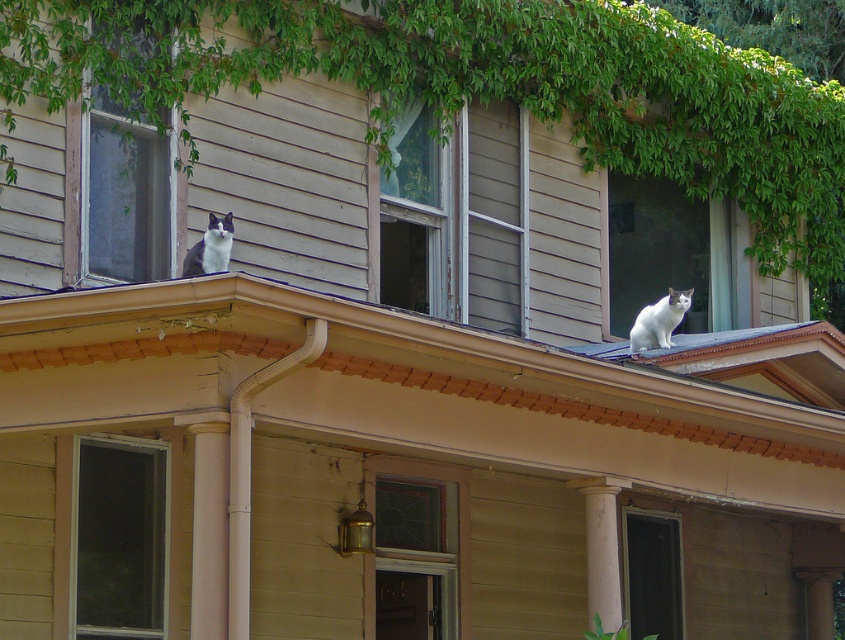
You are a contractor assessing the porch structure of the house. You see two columns supporting the porch roof. The columns are labeled as the white smooth column at center and the white marble column at center. According to building codes, the shorter column must be reinforced. Which column needs reinforcement?

The white marble column at center needs reinforcement because it is shorter than the white smooth column at center, as stated in the objects description.

You are standing in front of the two story house and want to locate two specific points marked on the roof. The first point is at coordinates point [508,182] and the second point is at point [706,280]. From your vantage point, which point is closer to you?

Point [508,182] is in front of point [706,280], so the first point is closer to you.

You are standing in front of the house and notice both the white smooth column at center and the white fur cat at upper right. Which object is positioned higher from the ground?

The white fur cat at upper right is positioned higher from the ground than the white smooth column at center because the column is located below the cat.